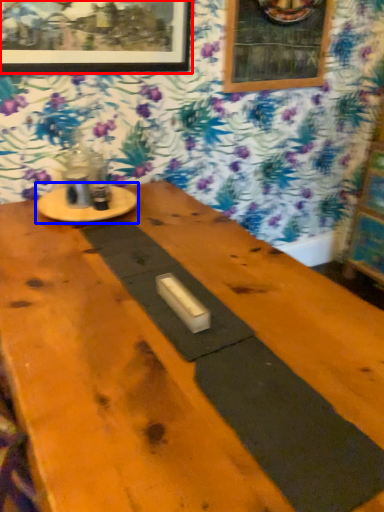
Question: Which object appears farthest to the camera in this image, picture frame (highlighted by a red box) or round table (highlighted by a blue box)?

Choices:
 (A) picture frame
 (B) round table

Answer: (B)